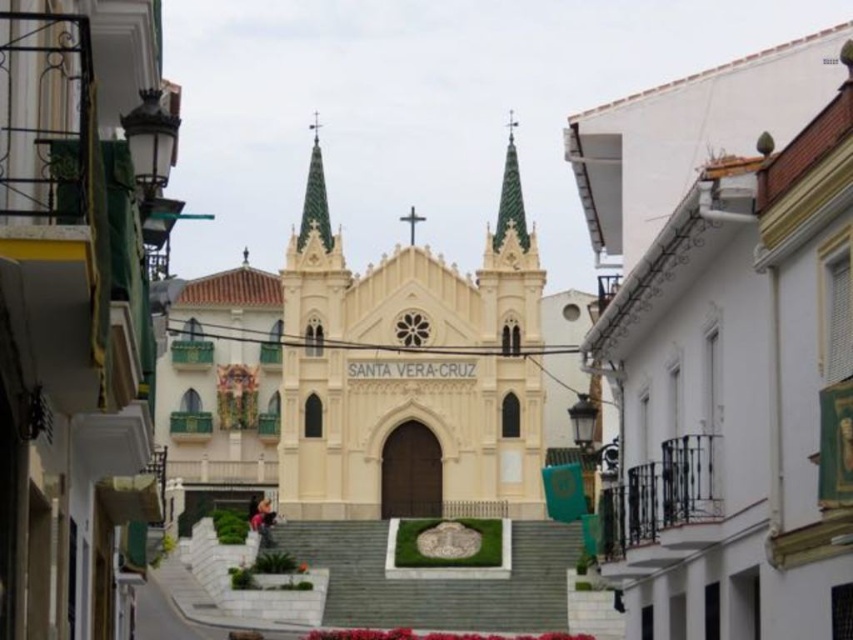
You are an architect analyzing the Santa Vera Cruz church. You need to determine if the white stone church at center is wider than the gold textured spire at center. Can you confirm this based on the architectural details provided?

The white stone church at center is wider than the gold textured spire at center, as its width surpasses that of the spire.

You are standing at the entrance of Santa Vera Cruz church. You want to go to the white matte building at center. Which direction should you walk to reach it?

The white matte building at center is located at point (x=726, y=342). Since you are at the entrance of the church, you should walk forward towards the center of the image to reach it.